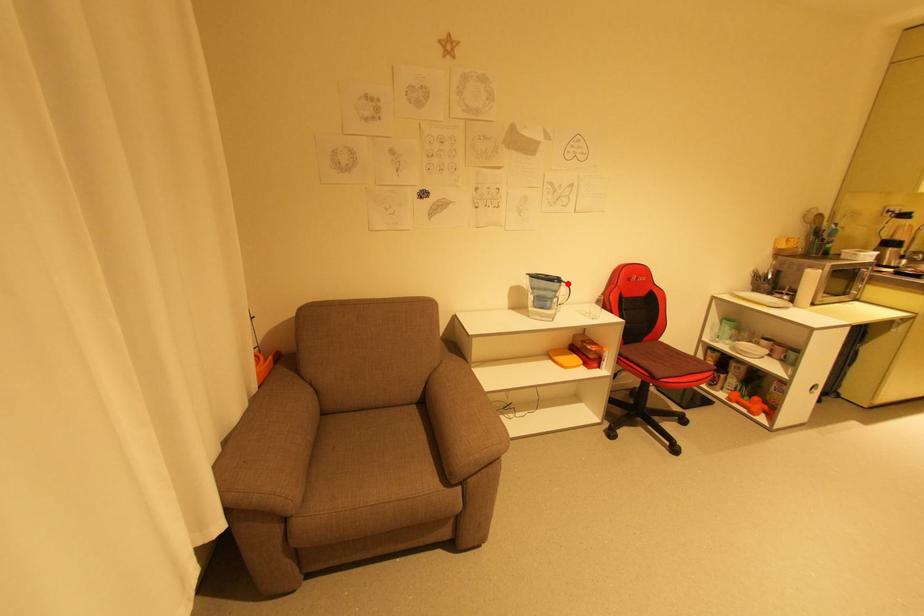
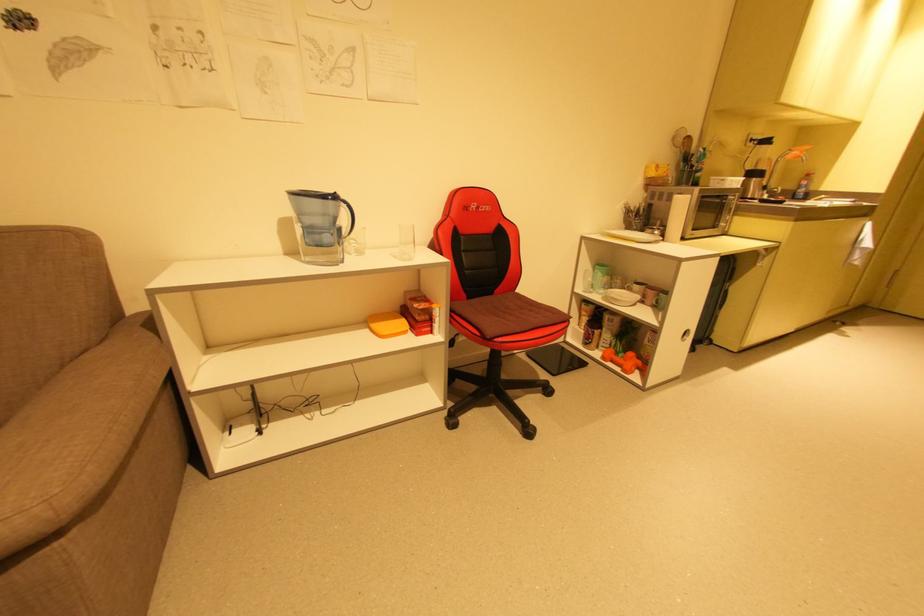
Question: I am providing you with two images of the same scene from different viewpoints. A red point is marked on the first image. Is the red point's position out of view in image 2?

Choices:
 (A) Yes
 (B) No

Answer: (B)